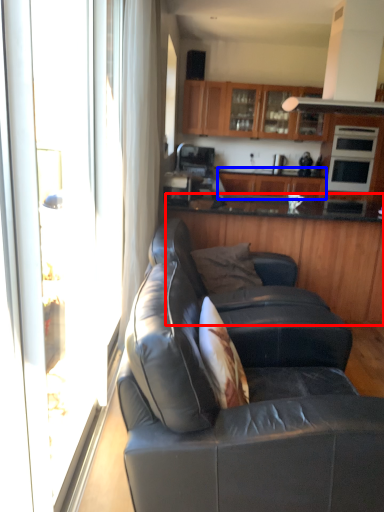
Question: Which point is further to the camera, cabinetry (highlighted by a red box) or cabinetry (highlighted by a blue box)?

Choices:
 (A) cabinetry
 (B) cabinetry

Answer: (B)